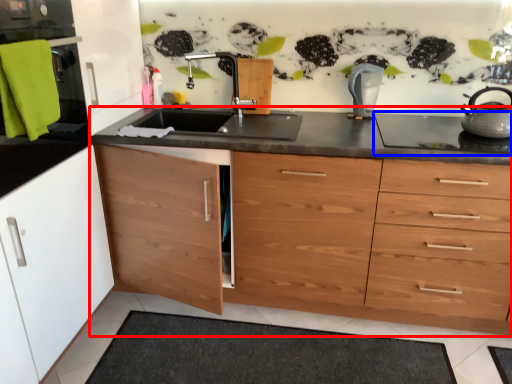
Question: Among these objects, which one is nearest to the camera, countertop (highlighted by a red box) or gas stove (highlighted by a blue box)?

Choices:
 (A) countertop
 (B) gas stove

Answer: (A)